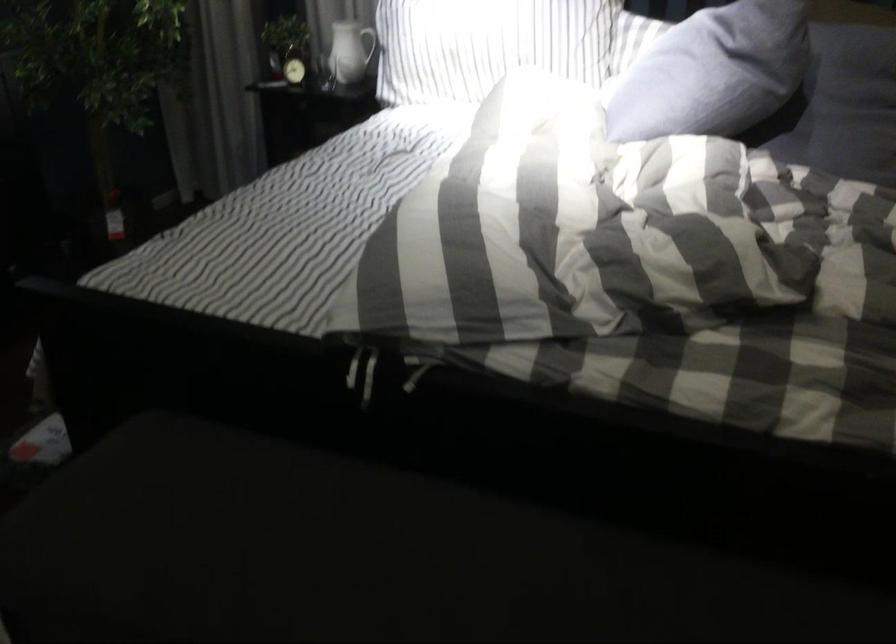
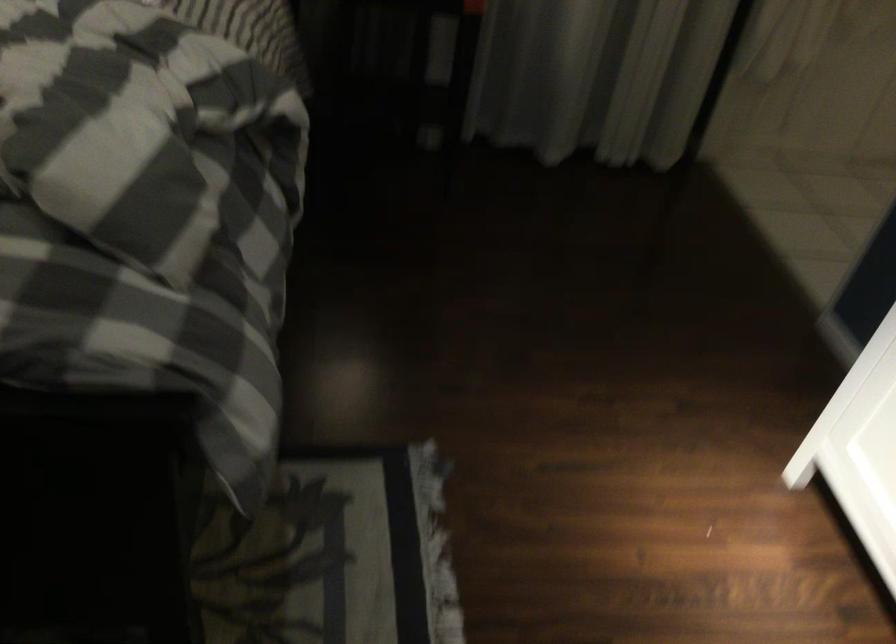
Question: The camera is either moving clockwise (left) or counter-clockwise (right) around the object. The first image is from the beginning of the video and the second image is from the end. Is the camera moving left or right when shooting the video?

Choices:
 (A) Left
 (B) Right

Answer: (A)